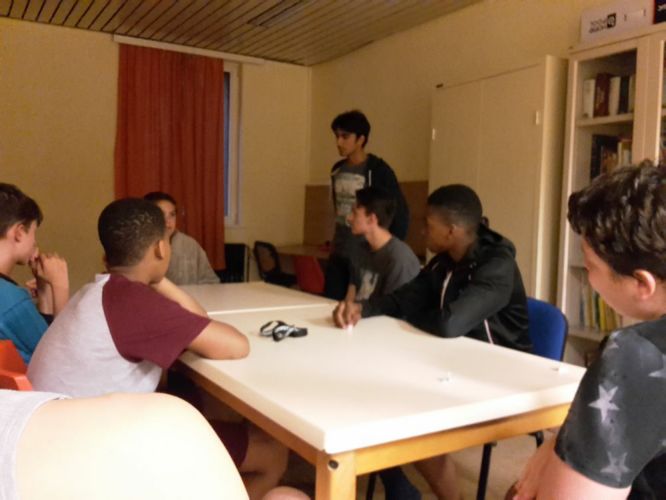
Image resolution: width=666 pixels, height=500 pixels. I want to click on wall, so click(71, 132).